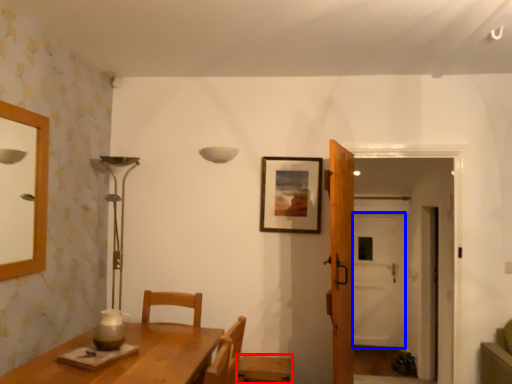
Question: Which point is further to the camera, chair (highlighted by a red box) or glass door (highlighted by a blue box)?

Choices:
 (A) chair
 (B) glass door

Answer: (B)